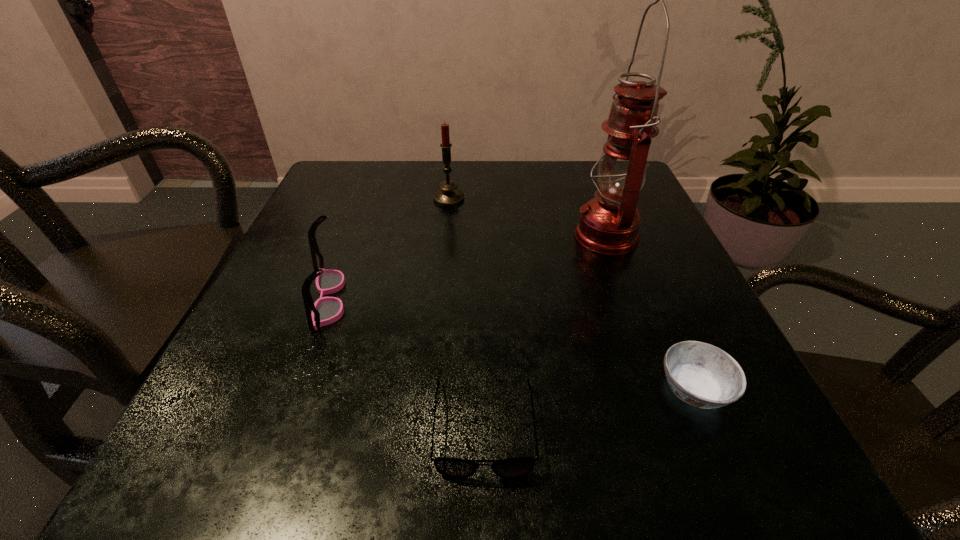
Locate an element on the screen. oil lamp is located at coordinates (609, 223).

This screenshot has height=540, width=960. Identify the location of the tallest object. (609, 223).

Locate an element on the screen. The width and height of the screenshot is (960, 540). candle is located at coordinates (448, 196).

Where is `the second tallest object`? This screenshot has width=960, height=540. the second tallest object is located at coordinates (448, 196).

The width and height of the screenshot is (960, 540). I want to click on the third shortest object, so click(x=326, y=310).

Locate an element on the screen. Image resolution: width=960 pixels, height=540 pixels. the farther spectacles is located at coordinates (326, 310).

Where is `ashtray`? ashtray is located at coordinates (700, 374).

Identify the location of the right spectacles. This screenshot has height=540, width=960. (455, 468).

The width and height of the screenshot is (960, 540). I want to click on the shorter spectacles, so click(x=455, y=468).

The height and width of the screenshot is (540, 960). In order to click on free location located on the left of the oil lamp in this screenshot , I will do `click(524, 235)`.